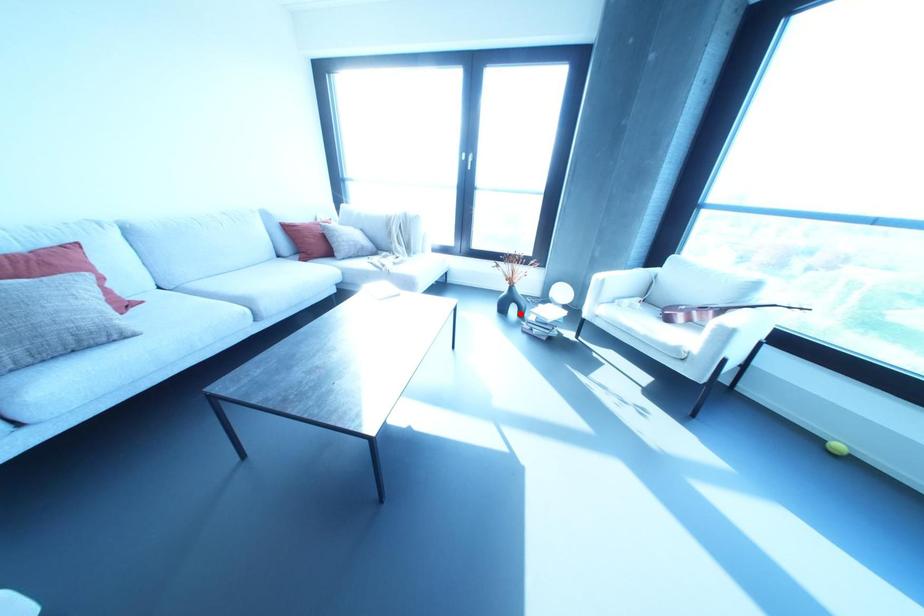
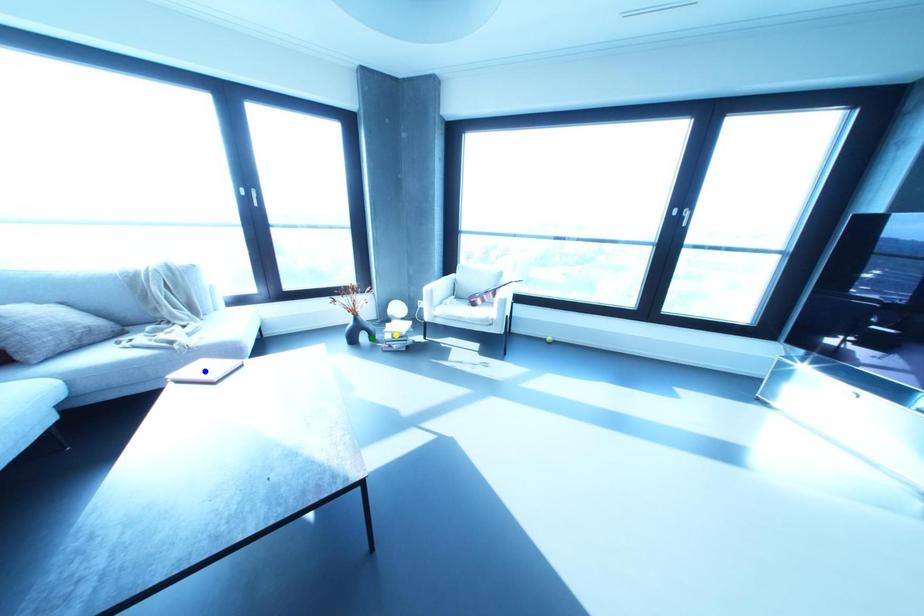
Question: I am providing you with two images of the same scene from different viewpoints. A red point is marked on the first image. You are given multiple points on the second image. Which point in image 2 is actually the same real-world point as the red point in image 1?

Choices:
 (A) blue point
 (B) green point
 (C) yellow point

Answer: (B)